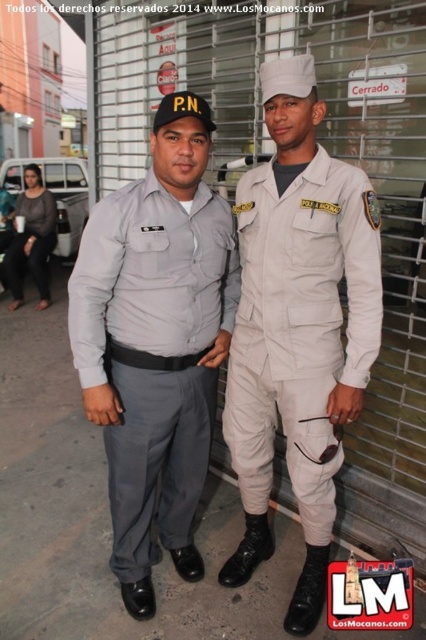
You are a tailor who needs to determine which clothing item requires more fabric to make between the gray fabric shirt at center and the beige fabric jumpsuit at center. Which one would need more fabric?

The gray fabric shirt at center is bigger than the beige fabric jumpsuit at center, so it would require more fabric to make.

You are a photographer positioned in front of the security gate. You want to take a photo where both the gray fabric shirt at center and the beige fabric jumpsuit at center are clearly visible. Based on their current positions, which person should move forward to ensure both are fully visible in the frame?

The beige fabric jumpsuit at center is behind the gray fabric shirt at center, so the beige fabric jumpsuit at center should move forward to avoid being blocked by the gray fabric shirt at center.

You are a photographer trying to capture both the beige fabric jumpsuit at center and the matte black uniform at left in a single frame. Since you want to emphasize the smaller subject, which one should you focus on to ensure it stands out more?

The beige fabric jumpsuit at center occupies less space than the matte black uniform at left, so focusing on the beige fabric jumpsuit at center would make it stand out more as the smaller subject.